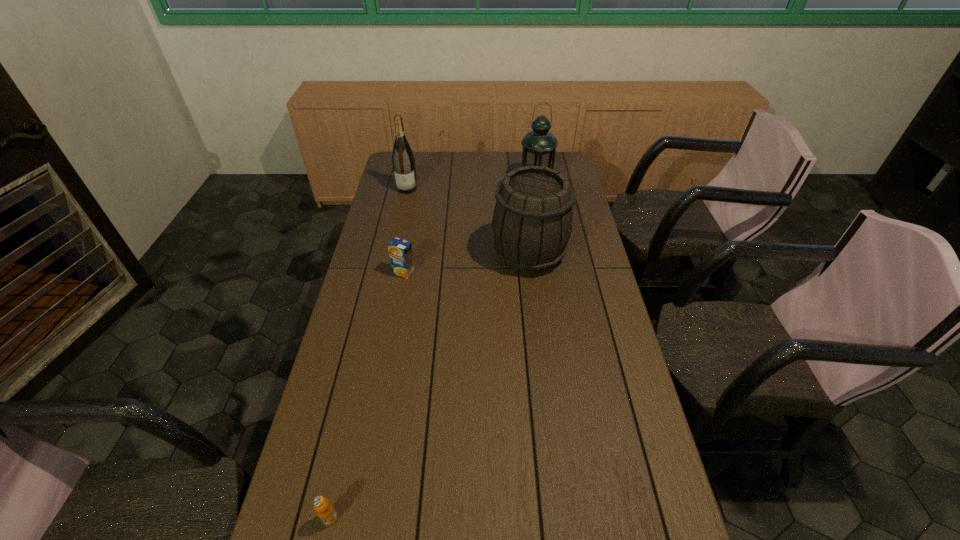
Find the location of `oil lamp`. oil lamp is located at coordinates (539, 146).

You are a GUI agent. You are given a task and a screenshot of the screen. Output one action in this format:
    pyautogui.click(x=<x>, y=<y>)
    Task: Click on the wine bottle
    The image size is (960, 540).
    Given the screenshot: What is the action you would take?
    pyautogui.click(x=403, y=161)

I want to click on wine bucket, so click(532, 222).

Find the location of a particular element. The width and height of the screenshot is (960, 540). the right orange juice is located at coordinates (400, 251).

Where is `the fourth tallest object`? The width and height of the screenshot is (960, 540). the fourth tallest object is located at coordinates (400, 251).

This screenshot has height=540, width=960. I want to click on the shortest object, so click(x=325, y=511).

Where is `the nearest object`? the nearest object is located at coordinates (325, 511).

The width and height of the screenshot is (960, 540). Find the location of `vacant area located on the back of the oil lamp`. vacant area located on the back of the oil lamp is located at coordinates (531, 154).

Where is `free space located on the label of the wine bottle`? This screenshot has width=960, height=540. free space located on the label of the wine bottle is located at coordinates (403, 205).

Identify the location of vacant space positioned on the front of the wine bucket. (540, 343).